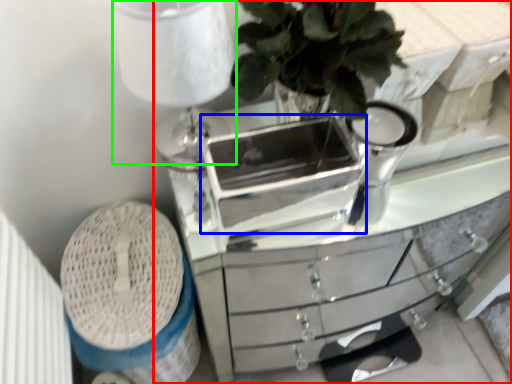
Question: Estimate the real-world distances between objects in this image. Which object is farther from chest of drawers (highlighted by a red box), appliance (highlighted by a blue box) or table lamp (highlighted by a green box)?

Choices:
 (A) appliance
 (B) table lamp

Answer: (A)